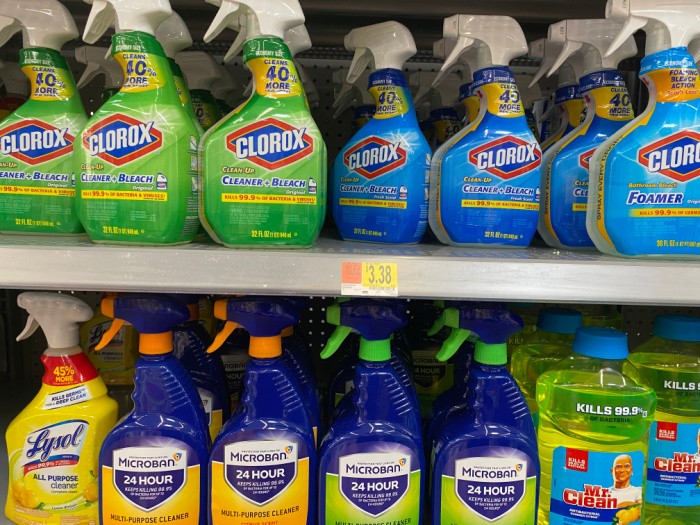
In order to click on shelf in this screenshot , I will do `click(466, 280)`.